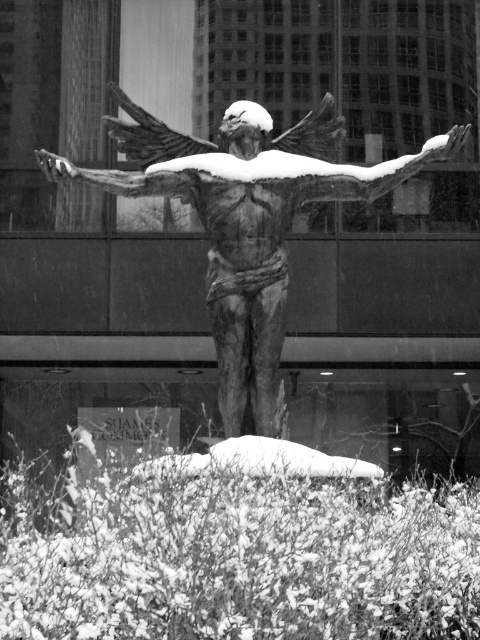
Which is below, rustic stone eagle at center or smooth bronze arm at center?

rustic stone eagle at center

How much distance is there between rustic stone eagle at center and smooth bronze arm at center?

They are 70.83 centimeters apart.

Does point (416, 163) come closer to viewer compared to point (54, 168)?

No, (416, 163) is further to viewer.

The width and height of the screenshot is (480, 640). Identify the location of rustic stone eagle at center. (247, 225).